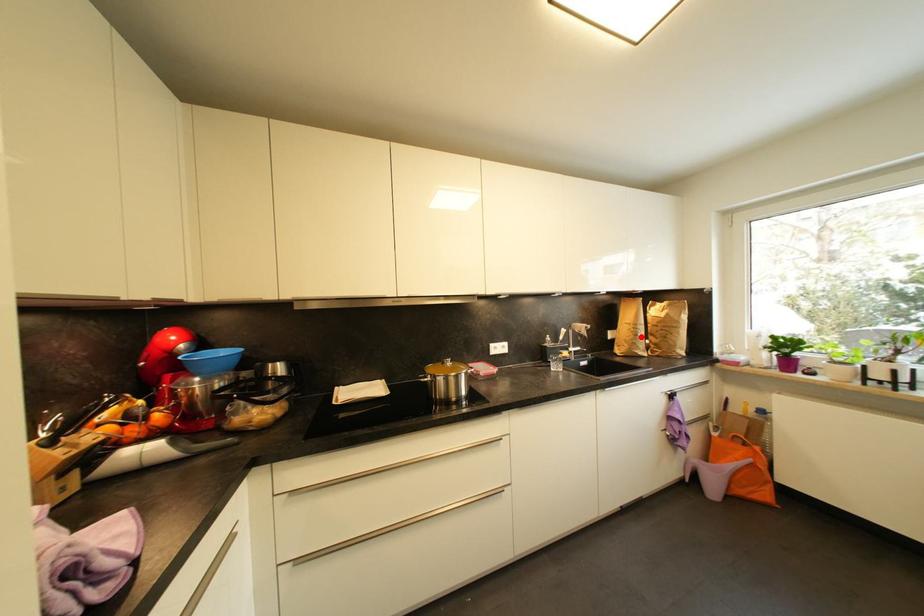
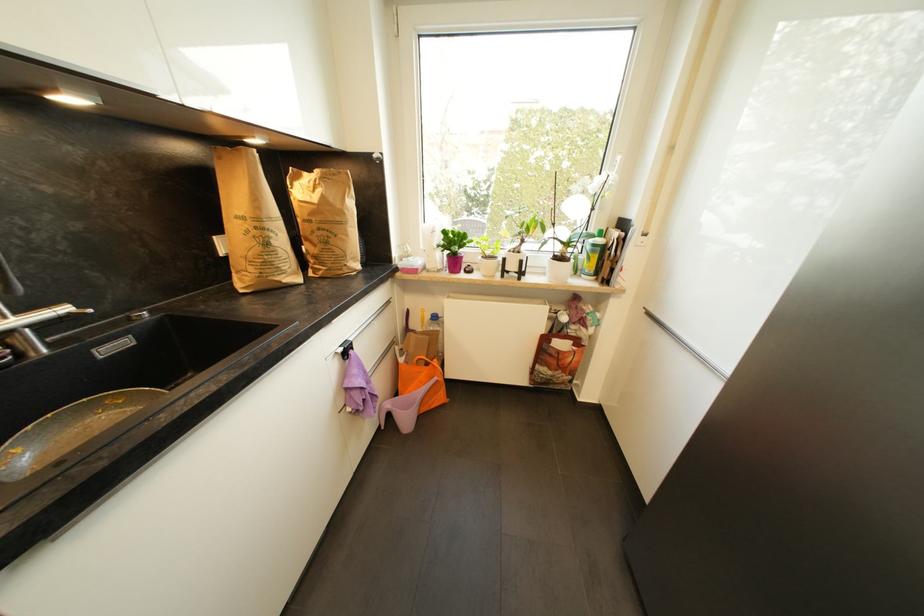
Question: I am providing you with two images of the same scene from different viewpoints. A red point is marked on the first image. Can you still see the location of the red point in image 2?

Choices:
 (A) Yes
 (B) No

Answer: (A)